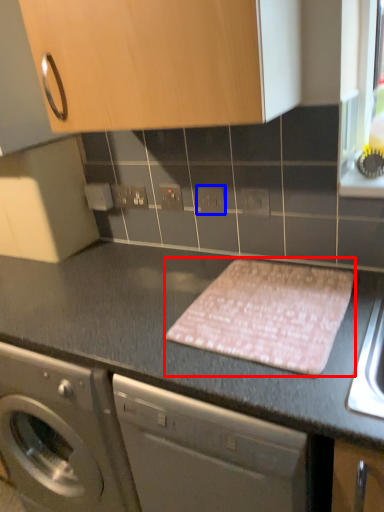
Question: Among these objects, which one is nearest to the camera, blanket (highlighted by a red box) or electric outlet (highlighted by a blue box)?

Choices:
 (A) blanket
 (B) electric outlet

Answer: (A)